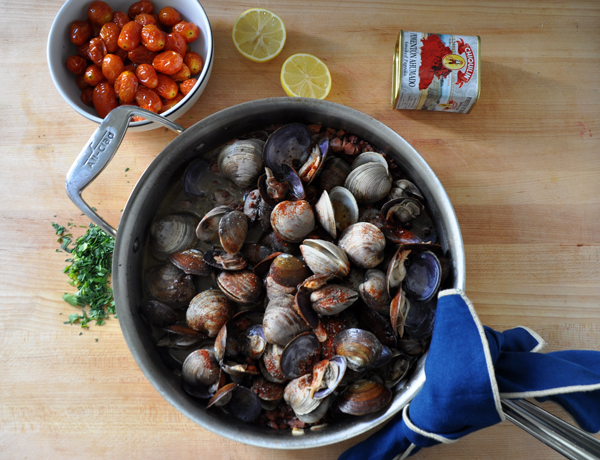
Find the location of a particular element. This screenshot has width=600, height=460. wooden surface is located at coordinates (528, 167), (93, 400).